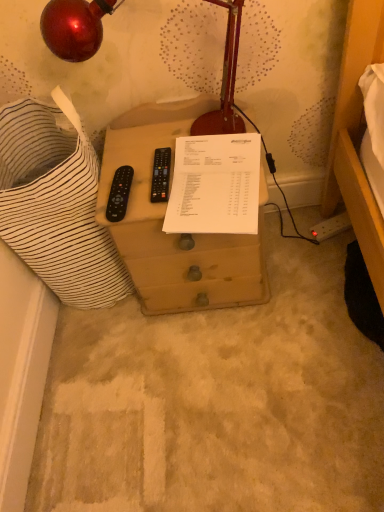
Question: Should I look upward or downward to see metallic red lamp at upper left?

Choices:
 (A) down
 (B) up

Answer: (B)

Question: Considering the relative sizes of metallic red lamp at upper left and white paper at center in the image provided, is metallic red lamp at upper left shorter than white paper at center?

Choices:
 (A) yes
 (B) no

Answer: (B)

Question: Is white paper at center a part of metallic red lamp at upper left?

Choices:
 (A) no
 (B) yes

Answer: (A)

Question: Is metallic red lamp at upper left oriented towards white paper at center?

Choices:
 (A) yes
 (B) no

Answer: (A)

Question: From a real-world perspective, is metallic red lamp at upper left beneath white paper at center?

Choices:
 (A) no
 (B) yes

Answer: (A)

Question: Is metallic red lamp at upper left thinner than white paper at center?

Choices:
 (A) yes
 (B) no

Answer: (A)

Question: Is metallic red lamp at upper left bigger than white paper at center?

Choices:
 (A) yes
 (B) no

Answer: (A)

Question: Is metallic red lamp at upper left thinner than brown wooden drawer at center?

Choices:
 (A) no
 (B) yes

Answer: (B)

Question: Is metallic red lamp at upper left located outside brown wooden drawer at center?

Choices:
 (A) no
 (B) yes

Answer: (B)

Question: Does metallic red lamp at upper left appear on the left side of brown wooden drawer at center?

Choices:
 (A) yes
 (B) no

Answer: (A)

Question: Is the position of metallic red lamp at upper left more distant than that of brown wooden drawer at center?

Choices:
 (A) yes
 (B) no

Answer: (B)

Question: Does metallic red lamp at upper left appear on the right side of brown wooden drawer at center?

Choices:
 (A) yes
 (B) no

Answer: (B)

Question: Is metallic red lamp at upper left looking in the opposite direction of brown wooden drawer at center?

Choices:
 (A) yes
 (B) no

Answer: (B)

Question: From a real-world perspective, does white paper at center stand above brown wooden drawer at center?

Choices:
 (A) no
 (B) yes

Answer: (B)